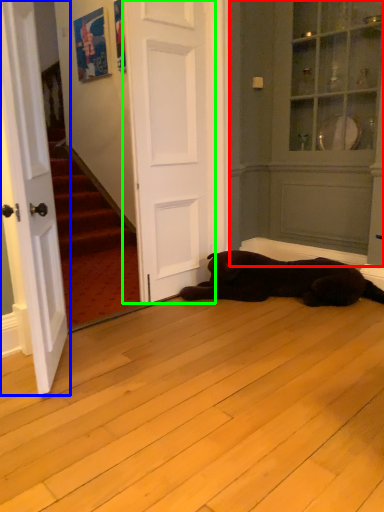
Question: Estimate the real-world distances between objects in this image. Which object is closer to armoire (highlighted by a red box), door (highlighted by a blue box) or door (highlighted by a green box)?

Choices:
 (A) door
 (B) door

Answer: (B)